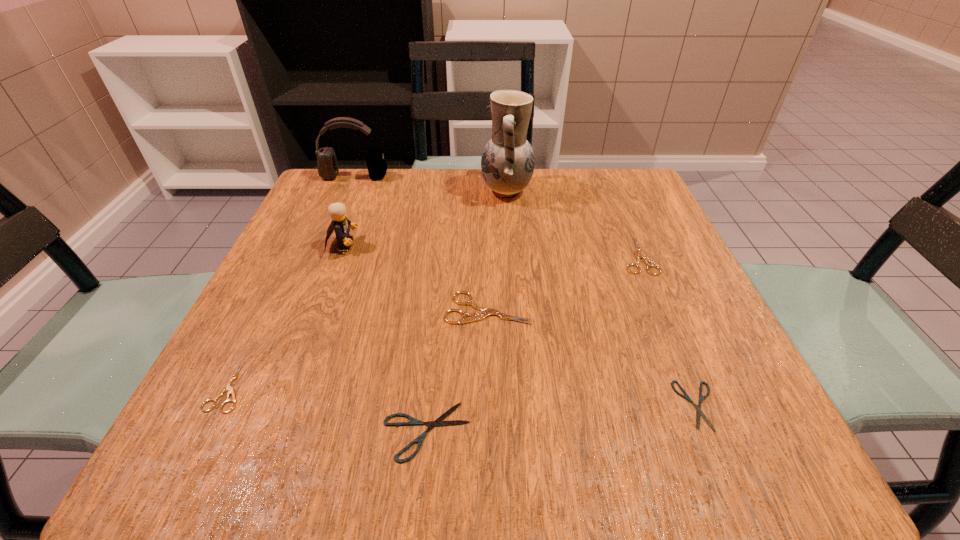
Locate an element on the screen. The height and width of the screenshot is (540, 960). vacant space in between the left black shears and the farthest shears is located at coordinates (532, 343).

Identify the location of free space that is in between the fourth nearest object and the left black shears. This screenshot has width=960, height=540. (457, 370).

You are a GUI agent. You are given a task and a screenshot of the screen. Output one action in this format:
    pyautogui.click(x=<x>, y=<y>)
    Task: Click on the vacant space that's between the leftmost beige shears and the left black shears
    The width and height of the screenshot is (960, 540).
    Given the screenshot: What is the action you would take?
    pyautogui.click(x=327, y=409)

At what (x,y) coordinates should I click in order to perform the action: click on free space between the second beige shears from left to right and the bigger black shears. Please return your answer as a coordinate pair (x, y). This screenshot has height=540, width=960. Looking at the image, I should click on (457, 370).

Locate an element on the screen. vacant region between the rightmost beige shears and the pottery is located at coordinates (572, 223).

This screenshot has width=960, height=540. What are the coordinates of `blank region between the smallest beige shears and the fourth shortest shears` in the screenshot? It's located at (433, 321).

In order to click on object that is the fifth closest to the nearest beige shears in this screenshot , I will do `click(507, 163)`.

Where is `the seventh closest object to the shortest shears`? the seventh closest object to the shortest shears is located at coordinates (328, 169).

Identify which shears is the third nearest to the nearest beige shears. Please provide its 2D coordinates. Your answer should be formatted as a tuple, i.e. [(x, y)], where the tuple contains the x and y coordinates of a point satisfying the conditions above.

[(698, 407)]

Select which shears is the closest to the black headset. Please provide its 2D coordinates. Your answer should be formatted as a tuple, i.e. [(x, y)], where the tuple contains the x and y coordinates of a point satisfying the conditions above.

[(475, 316)]